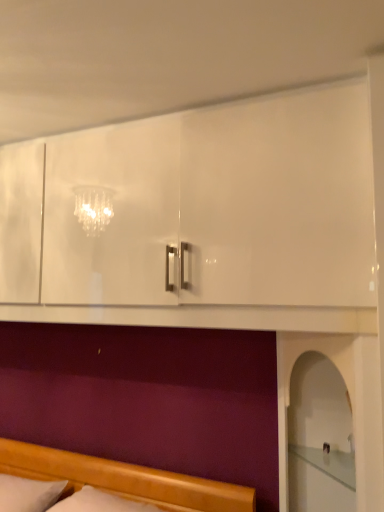
Question: From a real-world perspective, does wooden bed at lower left stand above white soft pillow at lower left?

Choices:
 (A) yes
 (B) no

Answer: (A)

Question: Can you confirm if wooden bed at lower left is wider than white soft pillow at lower left?

Choices:
 (A) yes
 (B) no

Answer: (A)

Question: From a real-world perspective, does wooden bed at lower left sit lower than white soft pillow at lower left?

Choices:
 (A) yes
 (B) no

Answer: (B)

Question: Is wooden bed at lower left in contact with white soft pillow at lower left?

Choices:
 (A) no
 (B) yes

Answer: (A)

Question: Is wooden bed at lower left positioned in front of white soft pillow at lower left?

Choices:
 (A) no
 (B) yes

Answer: (B)

Question: Would you say white glossy mantle at lower center is to the left or to the right of wooden bed at lower left in the picture?

Choices:
 (A) right
 (B) left

Answer: (B)

Question: In terms of width, does white glossy mantle at lower center look wider or thinner when compared to wooden bed at lower left?

Choices:
 (A) thin
 (B) wide

Answer: (B)

Question: Is point (132, 317) closer or farther from the camera than point (183, 488)?

Choices:
 (A) closer
 (B) farther

Answer: (A)

Question: Is white glossy mantle at lower center bigger or smaller than wooden bed at lower left?

Choices:
 (A) small
 (B) big

Answer: (A)

Question: Choose the correct answer: Is white soft pillow at lower left inside wooden bed at lower left or outside it?

Choices:
 (A) inside
 (B) outside

Answer: (B)

Question: From the image's perspective, is white soft pillow at lower left above or below wooden bed at lower left?

Choices:
 (A) below
 (B) above

Answer: (A)

Question: From a real-world perspective, is white soft pillow at lower left positioned above or below wooden bed at lower left?

Choices:
 (A) below
 (B) above

Answer: (A)

Question: Looking at the image, does white soft pillow at lower left seem bigger or smaller compared to wooden bed at lower left?

Choices:
 (A) small
 (B) big

Answer: (A)

Question: In the image, is white glossy mantle at lower center positioned in front of or behind white soft pillow at lower left?

Choices:
 (A) behind
 (B) front

Answer: (B)

Question: From a real-world perspective, relative to white soft pillow at lower left, is white glossy mantle at lower center vertically above or below?

Choices:
 (A) below
 (B) above

Answer: (B)